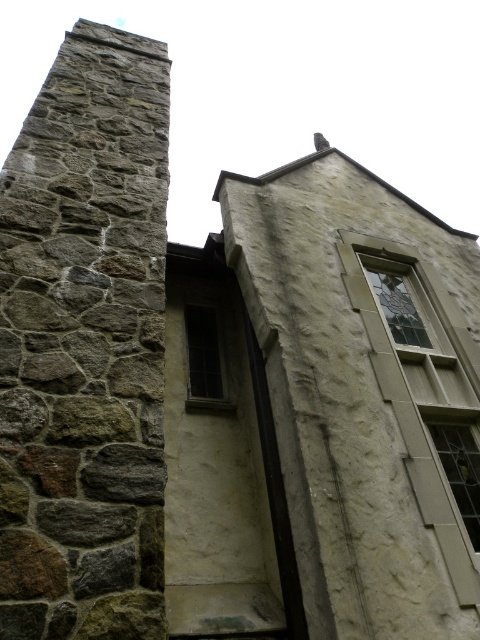
Question: Among these objects, which one is nearest to the camera?

Choices:
 (A) clear glass window at center right
 (B) clear glass window at center
 (C) rustic stone chimney at left

Answer: (C)

Question: Is rustic stone chimney at left in front of dark glass window at center?

Choices:
 (A) yes
 (B) no

Answer: (A)

Question: Which object is positioned farthest from the clear glass window at center right?

Choices:
 (A) rustic stone chimney at left
 (B) dark glass window at center

Answer: (A)

Question: Which object is positioned closest to the clear glass window at center right?

Choices:
 (A) dark glass window at center
 (B) rustic stone chimney at left
 (C) clear glass window at center

Answer: (C)

Question: Is rustic stone chimney at left closer to the viewer compared to clear glass window at center?

Choices:
 (A) yes
 (B) no

Answer: (A)

Question: Can you confirm if clear glass window at center is thinner than dark glass window at center?

Choices:
 (A) yes
 (B) no

Answer: (B)